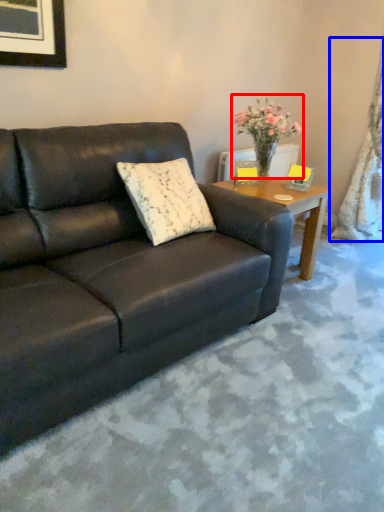
Question: Which object is closer to the camera taking this photo, houseplant (highlighted by a red box) or curtain (highlighted by a blue box)?

Choices:
 (A) houseplant
 (B) curtain

Answer: (A)